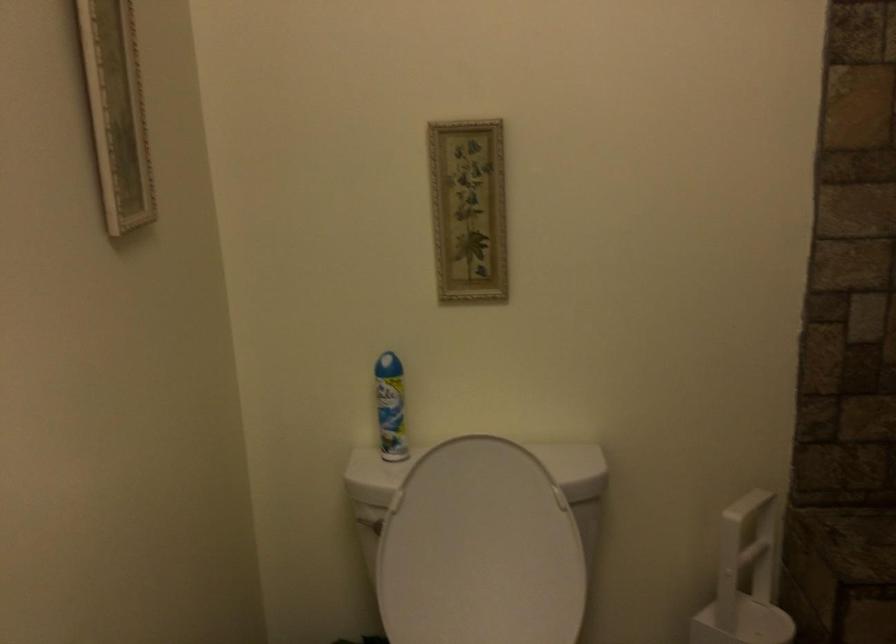
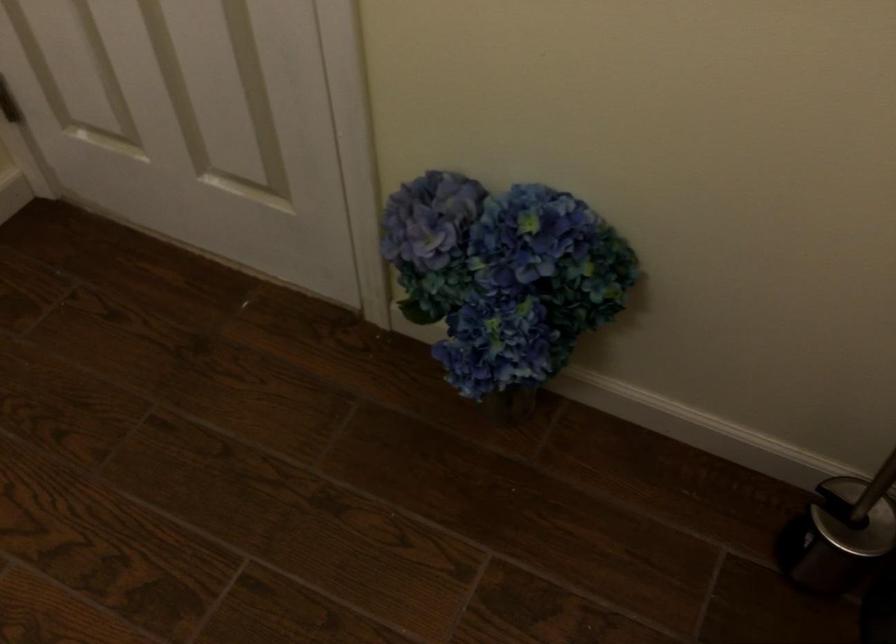
First-person continuous shooting, in which direction is the camera rotating?

The camera's rotation is toward left-down.